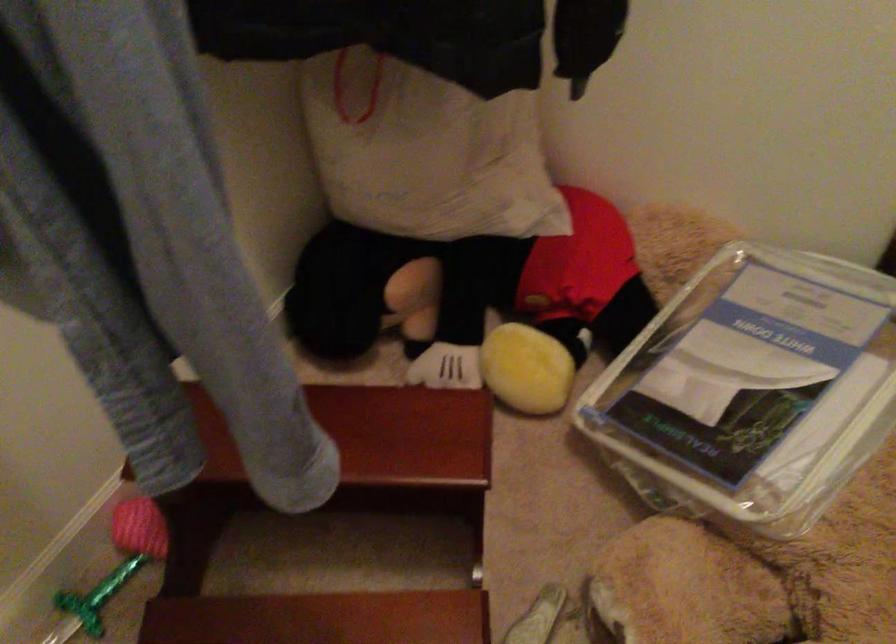
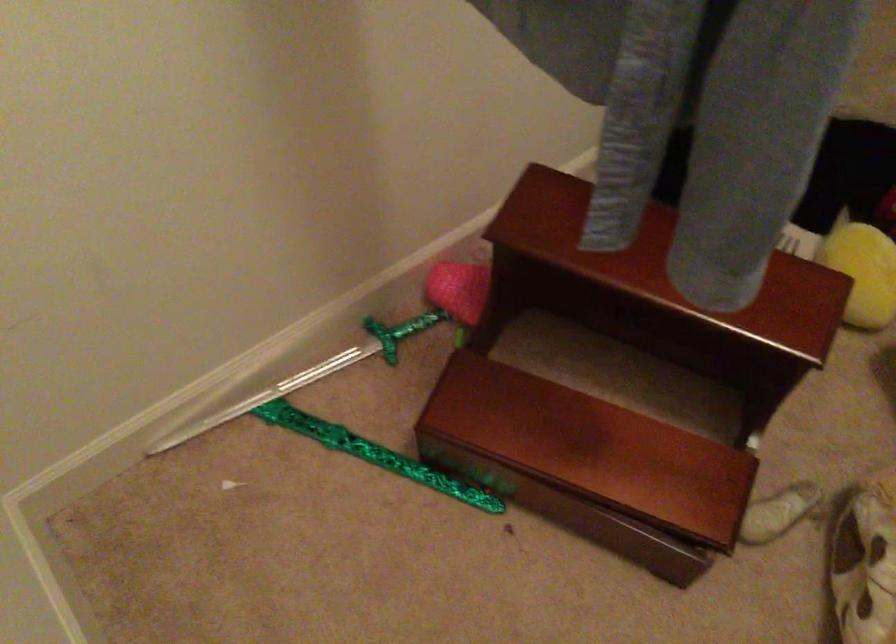
Where in the second image is the point corresponding to (x=349, y=556) from the first image?

(621, 384)